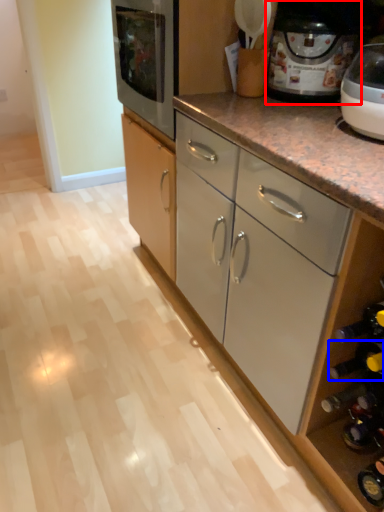
Question: Which object is closer to the camera taking this photo, home appliance (highlighted by a red box) or wine bottle (highlighted by a blue box)?

Choices:
 (A) home appliance
 (B) wine bottle

Answer: (B)